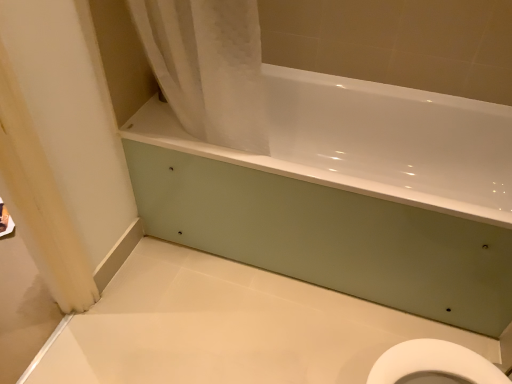
Question: In the image, is white fabric shower curtain at upper left on the left side or the right side of white glossy bathtub at center?

Choices:
 (A) right
 (B) left

Answer: (B)

Question: From the image's perspective, relative to white glossy bathtub at center, is white fabric shower curtain at upper left above or below?

Choices:
 (A) below
 (B) above

Answer: (B)

Question: Is white fabric shower curtain at upper left wider or thinner than white glossy bathtub at center?

Choices:
 (A) wide
 (B) thin

Answer: (B)

Question: Is white glossy bathtub at center in front of or behind white fabric shower curtain at upper left in the image?

Choices:
 (A) front
 (B) behind

Answer: (B)

Question: Considering the positions of white glossy bathtub at center and white fabric shower curtain at upper left in the image, is white glossy bathtub at center taller or shorter than white fabric shower curtain at upper left?

Choices:
 (A) short
 (B) tall

Answer: (A)

Question: From a real-world perspective, is white glossy bathtub at center above or below white fabric shower curtain at upper left?

Choices:
 (A) below
 (B) above

Answer: (A)

Question: In the image, is white glossy bathtub at center on the left side or the right side of white fabric shower curtain at upper left?

Choices:
 (A) left
 (B) right

Answer: (B)